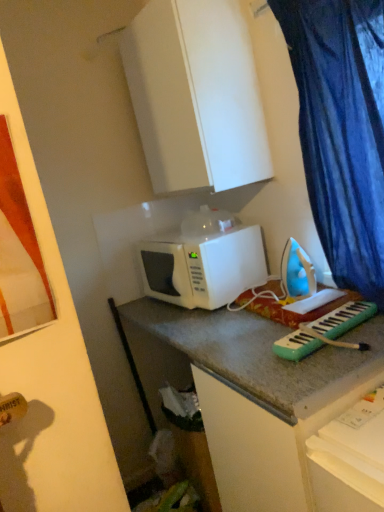
Question: Is point (130, 44) positioned closer to the camera than point (240, 251)?

Choices:
 (A) farther
 (B) closer

Answer: (A)

Question: Based on their sizes in the image, would you say white matte cabinet at upper center is bigger or smaller than white matte microwave at center?

Choices:
 (A) big
 (B) small

Answer: (A)

Question: Which object is the closest to the blue plastic iron at center-right?

Choices:
 (A) white matte microwave at center
 (B) white matte cabinet at upper center
 (C) green plastic keyboard at center-right
 (D) blue fabric curtain at right

Answer: (C)

Question: Which is nearer to the blue plastic iron at center-right?

Choices:
 (A) blue fabric curtain at right
 (B) green plastic keyboard at center-right
 (C) white matte microwave at center
 (D) white matte cabinet at upper center

Answer: (B)